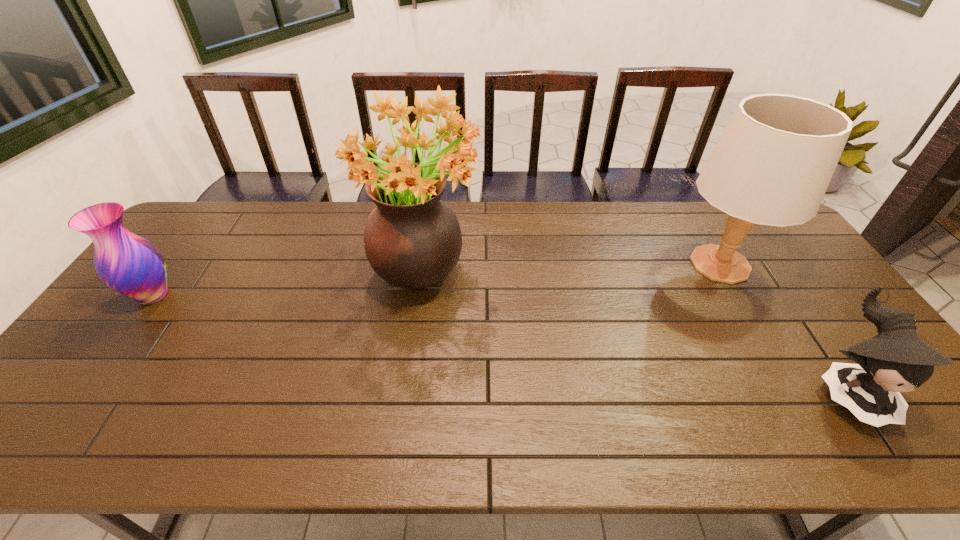
Locate an element on the screen. object situated at the left edge is located at coordinates (129, 264).

Where is `table lamp that is positioned at the right edge`? The image size is (960, 540). table lamp that is positioned at the right edge is located at coordinates (772, 165).

The width and height of the screenshot is (960, 540). Find the location of `doll located in the right edge section of the desktop`. doll located in the right edge section of the desktop is located at coordinates (896, 360).

I want to click on object located in the far right corner section of the desktop, so click(772, 165).

Where is `object that is positioned at the near right corner`? object that is positioned at the near right corner is located at coordinates (896, 360).

This screenshot has height=540, width=960. In the image, there is a desktop. Find the location of `vacant space at the far edge`. vacant space at the far edge is located at coordinates (654, 225).

Find the location of a particular element. vacant area at the near edge is located at coordinates (323, 426).

Where is `blank area at the left edge`? blank area at the left edge is located at coordinates (177, 307).

You are a GUI agent. You are given a task and a screenshot of the screen. Output one action in this format:
    pyautogui.click(x=<x>, y=<y>)
    Task: Click on the vacant space at the right edge of the desktop
    The height and width of the screenshot is (540, 960).
    Given the screenshot: What is the action you would take?
    pyautogui.click(x=845, y=362)

Image resolution: width=960 pixels, height=540 pixels. In the image, there is a desktop. Find the location of `vacant space at the far left corner`. vacant space at the far left corner is located at coordinates (224, 214).